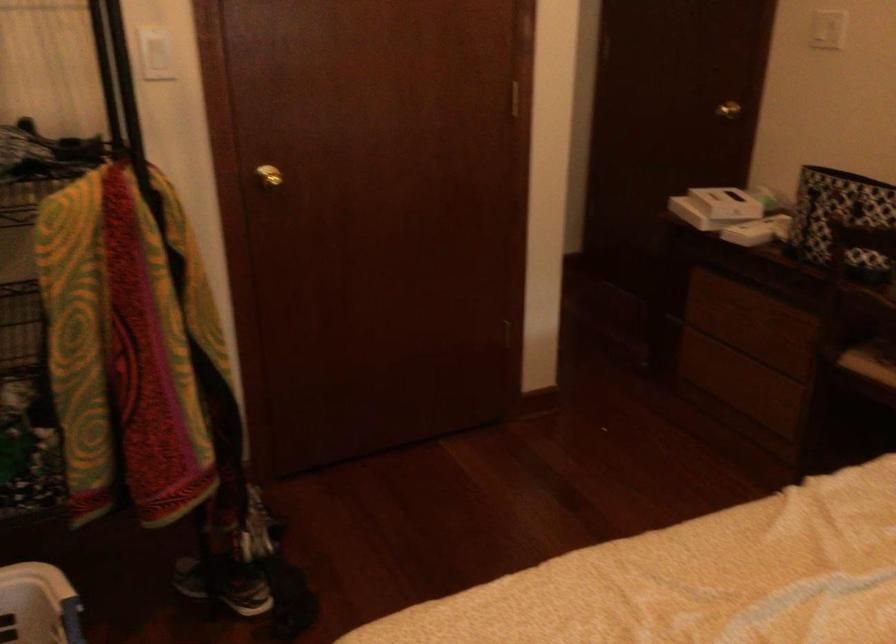
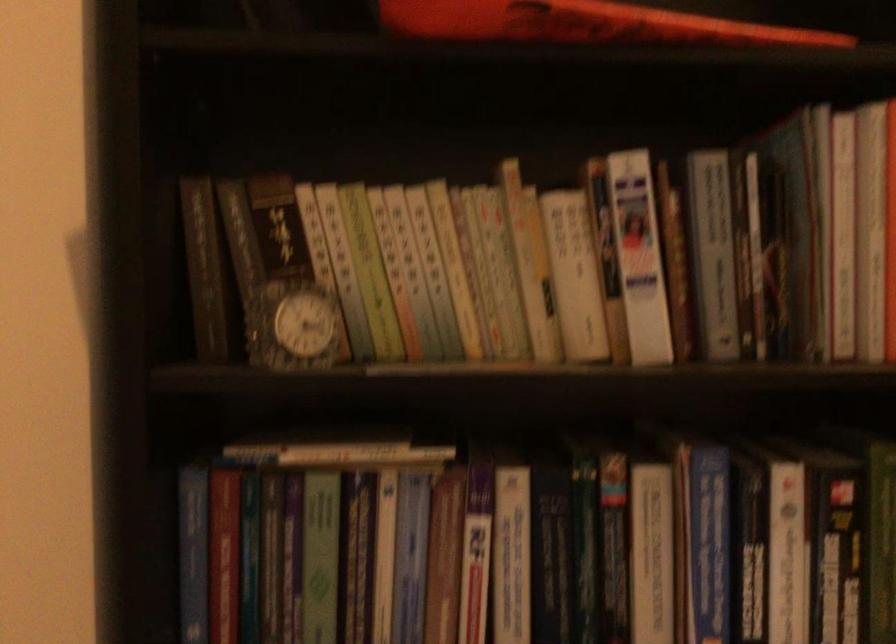
Question: The images are taken continuously from a first-person perspective. In which direction is your viewpoint rotating?

Choices:
 (A) Left
 (B) Right
 (C) Up
 (D) Down

Answer: (A)